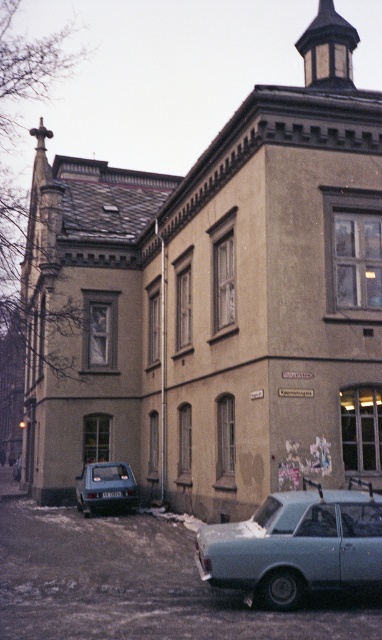
You are a delivery person who needs to park your van between the light blue metallic car at lower right and the matte blue hatchback at lower left. Can you fit your van, which is 5 meters long, in the space between them?

The light blue metallic car at lower right is larger than the matte blue hatchback at lower left, but the exact distance between them is not provided. Without knowing the actual space available, it is impossible to determine if the van will fit.

You are a delivery person approaching the building and need to park your vehicle. You see the light blue metallic car at lower right and the matte blue hatchback at lower left. Which car is closer to you as you approach the building?

The light blue metallic car at lower right is closer to you because it is in front of the matte blue hatchback at lower left.